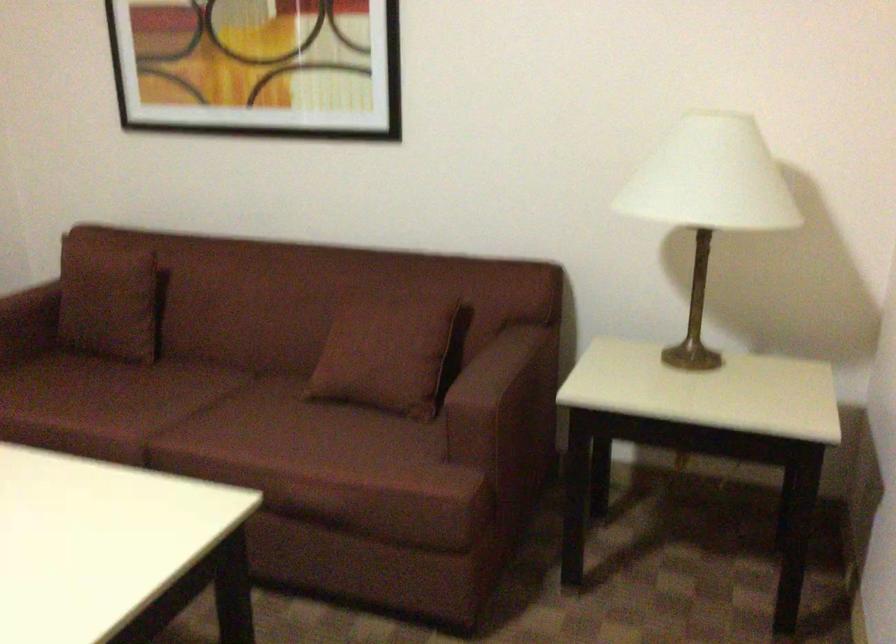
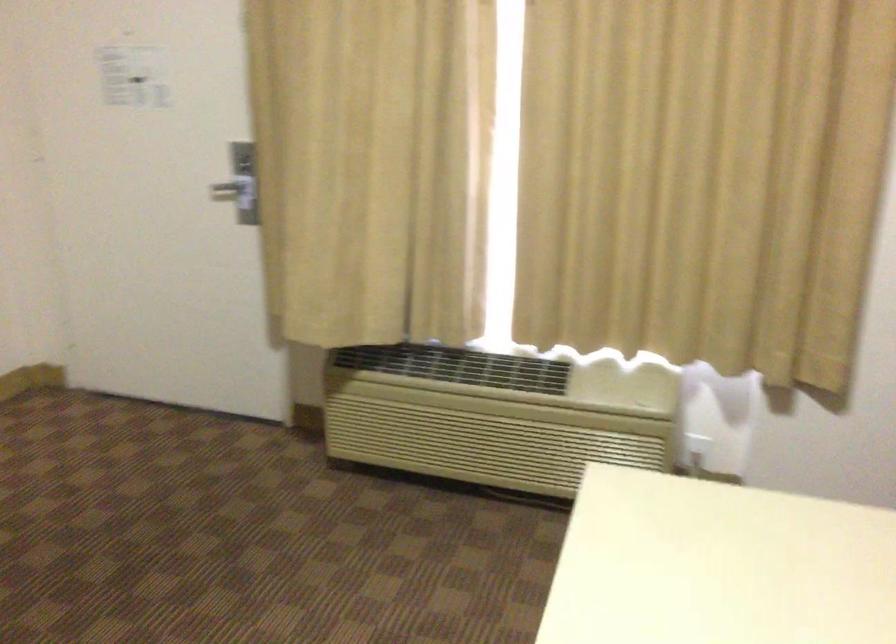
Question: The camera is either moving clockwise (left) or counter-clockwise (right) around the object. The first image is from the beginning of the video and the second image is from the end. Is the camera moving left or right when shooting the video?

Choices:
 (A) Left
 (B) Right

Answer: (B)